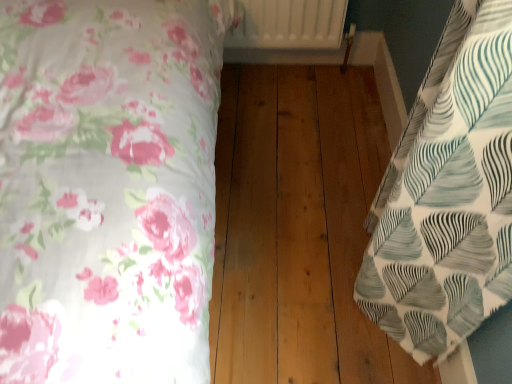
Locate an element on the screen. natural wood floor at center is located at coordinates (298, 229).

Describe the element at coordinates (108, 188) in the screenshot. This screenshot has width=512, height=384. I see `white floral fabric at left, which appears as the 2th bed when viewed from the right` at that location.

Where is `white textured fabric at right, which is counted as the first bed, starting from the right`? white textured fabric at right, which is counted as the first bed, starting from the right is located at coordinates (447, 194).

In order to click on natural wood floor at center in this screenshot , I will do `click(298, 229)`.

Considering the relative sizes of white matte radiator at upper center and white floral fabric at left, which appears as the 2th bed when viewed from the right, in the image provided, is white matte radiator at upper center thinner than white floral fabric at left, which appears as the 2th bed when viewed from the right,?

Yes.

From their relative heights in the image, would you say white matte radiator at upper center is taller or shorter than white floral fabric at left, which appears as the 2th bed when viewed from the right?

Considering their sizes, white matte radiator at upper center has less height than white floral fabric at left, which appears as the 2th bed when viewed from the right.

From the picture: Is white matte radiator at upper center turned away from white floral fabric at left, acting as the first bed starting from the left?

white matte radiator at upper center does not have its back to white floral fabric at left, acting as the first bed starting from the left.

In the scene shown: From the image's perspective, which is below, white matte radiator at upper center or white floral fabric at left, which appears as the 2th bed when viewed from the right?

white floral fabric at left, which appears as the 2th bed when viewed from the right, appears lower in the image.

From the image's perspective, is white textured fabric at right, the second bed when ordered from left to right, over natural wood floor at center?

Yes, from the image's perspective, white textured fabric at right, the second bed when ordered from left to right, is above natural wood floor at center.

Consider the image. Based on their sizes in the image, would you say white textured fabric at right, the second bed when ordered from left to right, is bigger or smaller than natural wood floor at center?

Considering their sizes, white textured fabric at right, the second bed when ordered from left to right, takes up less space than natural wood floor at center.

From the picture: Is white textured fabric at right, which is counted as the first bed, starting from the right, oriented away from natural wood floor at center?

No, white textured fabric at right, which is counted as the first bed, starting from the right, is not facing away from natural wood floor at center.

In the scene shown: Is white textured fabric at right, which is counted as the first bed, starting from the right, in front of or behind natural wood floor at center in the image?

white textured fabric at right, which is counted as the first bed, starting from the right, is in front of natural wood floor at center.

Could white textured fabric at right, the second bed when ordered from left to right, be considered to be inside white matte radiator at upper center?

No, white textured fabric at right, the second bed when ordered from left to right, is not surrounded by white matte radiator at upper center.

Looking at this image, who is bigger, white matte radiator at upper center or white textured fabric at right, the second bed when ordered from left to right?

white matte radiator at upper center.

Does white textured fabric at right, the second bed when ordered from left to right, have a greater height compared to white floral fabric at left, acting as the first bed starting from the left?

Incorrect, the height of white textured fabric at right, the second bed when ordered from left to right, is not larger of that of white floral fabric at left, acting as the first bed starting from the left.

Locate an element on the screen. bed that appears on the right of white floral fabric at left, acting as the first bed starting from the left is located at coordinates point(447,194).

Is white textured fabric at right, the second bed when ordered from left to right, bigger or smaller than white floral fabric at left, acting as the first bed starting from the left?

In the image, white textured fabric at right, the second bed when ordered from left to right, appears to be smaller than white floral fabric at left, acting as the first bed starting from the left.

How different are the orientations of white textured fabric at right, the second bed when ordered from left to right, and white floral fabric at left, acting as the first bed starting from the left, in degrees?

They differ by 180 degrees in their facing directions.

From a real-world perspective, is white textured fabric at right, which is counted as the first bed, starting from the right, located higher than white matte radiator at upper center?

Incorrect, from a real-world perspective, white textured fabric at right, which is counted as the first bed, starting from the right, is lower than white matte radiator at upper center.

Considering the relative sizes of white textured fabric at right, which is counted as the first bed, starting from the right, and white matte radiator at upper center in the image provided, is white textured fabric at right, which is counted as the first bed, starting from the right, thinner than white matte radiator at upper center?

Correct, the width of white textured fabric at right, which is counted as the first bed, starting from the right, is less than that of white matte radiator at upper center.

Between white textured fabric at right, the second bed when ordered from left to right, and white matte radiator at upper center, which one has smaller size?

white textured fabric at right, the second bed when ordered from left to right, is smaller.

From the image's perspective, is white textured fabric at right, which is counted as the first bed, starting from the right, under white matte radiator at upper center?

Yes, from the image's perspective, white textured fabric at right, which is counted as the first bed, starting from the right, is below white matte radiator at upper center.

In the scene shown: Between white floral fabric at left, acting as the first bed starting from the left, and white textured fabric at right, which is counted as the first bed, starting from the right, which one has more height?

white floral fabric at left, acting as the first bed starting from the left, is taller.

Considering the positions of points (106, 106) and (446, 63), is point (106, 106) closer to camera compared to point (446, 63)?

No, it is not.

Which is more to the right, white floral fabric at left, which appears as the 2th bed when viewed from the right, or white textured fabric at right, which is counted as the first bed, starting from the right?

white textured fabric at right, which is counted as the first bed, starting from the right, is more to the right.

From a real-world perspective, which is physically above, natural wood floor at center or white matte radiator at upper center?

From a 3D spatial view, white matte radiator at upper center is above.

Does natural wood floor at center appear on the left side of white matte radiator at upper center?

No, natural wood floor at center is not to the left of white matte radiator at upper center.

Is natural wood floor at center surrounding white matte radiator at upper center?

No, white matte radiator at upper center is not surrounded by natural wood floor at center.

At what (x,y) coordinates should I click in order to perform the action: click on radiator located underneath the white floral fabric at left, which appears as the 2th bed when viewed from the right (from a real-world perspective). Please return your answer as a coordinate pair (x, y). Looking at the image, I should click on (288, 24).

Find the location of a particular element. Image resolution: width=512 pixels, height=384 pixels. the 1st bed located above the natural wood floor at center (from a real-world perspective) is located at coordinates (447, 194).

From the image, which object appears to be nearer to natural wood floor at center, white textured fabric at right, the second bed when ordered from left to right, or white floral fabric at left, acting as the first bed starting from the left?

white textured fabric at right, the second bed when ordered from left to right, is positioned closer to the anchor natural wood floor at center.

Estimate the real-world distances between objects in this image. Which object is further from natural wood floor at center, white matte radiator at upper center or white textured fabric at right, which is counted as the first bed, starting from the right?

Among the two, white matte radiator at upper center is located further to natural wood floor at center.

When comparing their distances from white textured fabric at right, the second bed when ordered from left to right, does natural wood floor at center or white floral fabric at left, acting as the first bed starting from the left, seem closer?

natural wood floor at center.

Based on their spatial positions, is white matte radiator at upper center or white floral fabric at left, acting as the first bed starting from the left, further from natural wood floor at center?

white floral fabric at left, acting as the first bed starting from the left.

Based on their spatial positions, is white floral fabric at left, which appears as the 2th bed when viewed from the right, or white textured fabric at right, which is counted as the first bed, starting from the right, closer to white matte radiator at upper center?

Based on the image, white floral fabric at left, which appears as the 2th bed when viewed from the right, appears to be nearer to white matte radiator at upper center.

Based on their spatial positions, is white textured fabric at right, the second bed when ordered from left to right, or white matte radiator at upper center further from natural wood floor at center?

Among the two, white matte radiator at upper center is located further to natural wood floor at center.

When comparing their distances from white matte radiator at upper center, does white textured fabric at right, which is counted as the first bed, starting from the right, or natural wood floor at center seem closer?

Based on the image, natural wood floor at center appears to be nearer to white matte radiator at upper center.

Looking at the image, which one is located further to white textured fabric at right, which is counted as the first bed, starting from the right, natural wood floor at center or white matte radiator at upper center?

The object further to white textured fabric at right, which is counted as the first bed, starting from the right, is white matte radiator at upper center.

Find the location of a particular element. bed between white floral fabric at left, which appears as the 2th bed when viewed from the right, and white matte radiator at upper center from front to back is located at coordinates (447, 194).

Identify the location of hardwood between white floral fabric at left, acting as the first bed starting from the left, and white textured fabric at right, which is counted as the first bed, starting from the right. (298, 229).

This screenshot has width=512, height=384. What are the coordinates of `hardwood positioned between white floral fabric at left, which appears as the 2th bed when viewed from the right, and white matte radiator at upper center from near to far` in the screenshot? It's located at (298, 229).